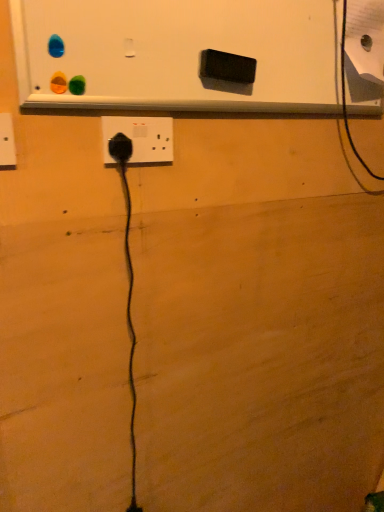
Question: Could black plastic power plug at left, the 1th power plugs and sockets positioned from the front, be considered to be inside black rubber power plug at center, placed as the first power plugs and sockets when sorted from back to front?

Choices:
 (A) no
 (B) yes

Answer: (A)

Question: From a real-world perspective, is black rubber power plug at center, placed as the first power plugs and sockets when sorted from back to front, physically above black plastic power plug at left, the 1th power plugs and sockets positioned from the front?

Choices:
 (A) no
 (B) yes

Answer: (A)

Question: Can you confirm if black rubber power plug at center, the 3th power plugs and sockets positioned from the front, is smaller than black plastic power plug at left, the 1th power plugs and sockets positioned from the front?

Choices:
 (A) no
 (B) yes

Answer: (B)

Question: Is black rubber power plug at center, the second power plugs and sockets from the right, outside of black plastic power plug at left, the third power plugs and sockets from the right?

Choices:
 (A) yes
 (B) no

Answer: (A)

Question: Considering the relative sizes of black rubber power plug at center, the 3th power plugs and sockets positioned from the front, and black plastic power plug at left, the third power plugs and sockets from the right, in the image provided, is black rubber power plug at center, the 3th power plugs and sockets positioned from the front, bigger than black plastic power plug at left, the third power plugs and sockets from the right,?

Choices:
 (A) yes
 (B) no

Answer: (B)

Question: Can you confirm if black rubber power plug at center, marked as the 2th power plugs and sockets in a left-to-right arrangement, is shorter than black plastic power plug at left, the 1th power plugs and sockets positioned from the front?

Choices:
 (A) no
 (B) yes

Answer: (B)

Question: Does black plastic power plug at left, the third power plugs and sockets from the right, have a smaller size compared to black plastic power plug at center, the 1th power plugs and sockets in the right-to-left sequence?

Choices:
 (A) yes
 (B) no

Answer: (A)

Question: From a real-world perspective, is black plastic power plug at left, the third power plugs and sockets from the right, under black plastic power plug at center, the third power plugs and sockets from the left?

Choices:
 (A) no
 (B) yes

Answer: (A)

Question: Is black plastic power plug at left, the third power plugs and sockets from the right, positioned beyond the bounds of black plastic power plug at center, marked as the 2th power plugs and sockets in a back-to-front arrangement?

Choices:
 (A) no
 (B) yes

Answer: (B)

Question: Is black plastic power plug at left, the third power plugs and sockets from the right, taller than black plastic power plug at center, marked as the 2th power plugs and sockets in a back-to-front arrangement?

Choices:
 (A) no
 (B) yes

Answer: (A)

Question: Does black plastic power plug at left, the third power plugs and sockets from the right, have a lesser height compared to black plastic power plug at center, which is the 2th power plugs and sockets in front-to-back order?

Choices:
 (A) no
 (B) yes

Answer: (B)

Question: Is black plastic power plug at left, which is the 1th power plugs and sockets in left-to-right order, with black plastic power plug at center, which is the 2th power plugs and sockets in front-to-back order?

Choices:
 (A) no
 (B) yes

Answer: (A)

Question: Is black plastic power plug at left, the 1th power plugs and sockets positioned from the front, to the left of white matte bulletin board at upper center from the viewer's perspective?

Choices:
 (A) yes
 (B) no

Answer: (A)